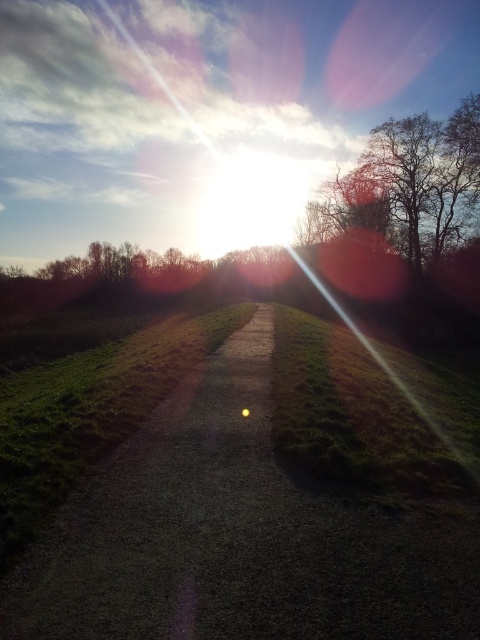
Question: Which point appears farthest from the camera in this image?

Choices:
 (A) (433, 170)
 (B) (165, 593)

Answer: (A)

Question: Does gravel path at center appear on the left side of bare branches at upper right?

Choices:
 (A) yes
 (B) no

Answer: (A)

Question: Which of the following is the farthest from the observer?

Choices:
 (A) click(311, 509)
 (B) click(387, 161)

Answer: (B)

Question: Which point is farther to the camera?

Choices:
 (A) (459, 170)
 (B) (135, 602)

Answer: (A)

Question: Is the position of gravel path at center more distant than that of bare branches at upper right?

Choices:
 (A) no
 (B) yes

Answer: (A)

Question: Can you confirm if gravel path at center is positioned to the right of bare branches at upper right?

Choices:
 (A) no
 (B) yes

Answer: (A)